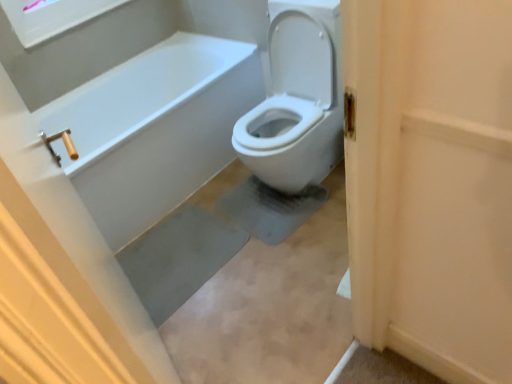
Question: Does white glossy toilet at center have a greater height compared to white matte screen door at upper right?

Choices:
 (A) no
 (B) yes

Answer: (B)

Question: Could white matte screen door at upper right be considered to be inside white glossy toilet at center?

Choices:
 (A) no
 (B) yes

Answer: (A)

Question: Considering the relative positions of white glossy toilet at center and white matte screen door at upper right in the image provided, is white glossy toilet at center to the right of white matte screen door at upper right from the viewer's perspective?

Choices:
 (A) yes
 (B) no

Answer: (B)

Question: Is white glossy toilet at center at the left side of white matte screen door at upper right?

Choices:
 (A) yes
 (B) no

Answer: (A)

Question: From the image's perspective, is white glossy toilet at center located beneath white matte screen door at upper right?

Choices:
 (A) no
 (B) yes

Answer: (A)

Question: Is white glossy toilet at center thinner than white matte screen door at upper right?

Choices:
 (A) no
 (B) yes

Answer: (A)

Question: From a real-world perspective, is white matte screen door at upper right physically below white glossy toilet at center?

Choices:
 (A) yes
 (B) no

Answer: (B)

Question: Can you confirm if white matte screen door at upper right is taller than white glossy toilet at center?

Choices:
 (A) no
 (B) yes

Answer: (A)

Question: Is white matte screen door at upper right in front of white glossy toilet at center?

Choices:
 (A) no
 (B) yes

Answer: (B)

Question: From a real-world perspective, is white matte screen door at upper right on top of white glossy toilet at center?

Choices:
 (A) yes
 (B) no

Answer: (A)

Question: Could you tell me if white matte screen door at upper right is facing white glossy toilet at center?

Choices:
 (A) no
 (B) yes

Answer: (A)

Question: Considering the relative positions of white matte screen door at upper right and white glossy toilet at center in the image provided, is white matte screen door at upper right behind white glossy toilet at center?

Choices:
 (A) no
 (B) yes

Answer: (A)

Question: From a real-world perspective, relative to white glossy toilet at center, is white matte screen door at upper right vertically above or below?

Choices:
 (A) above
 (B) below

Answer: (A)